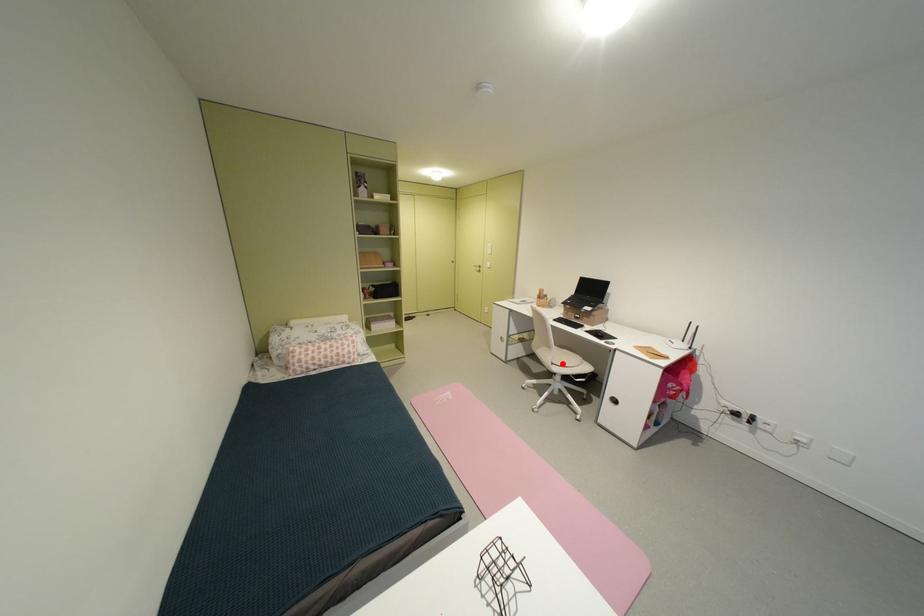
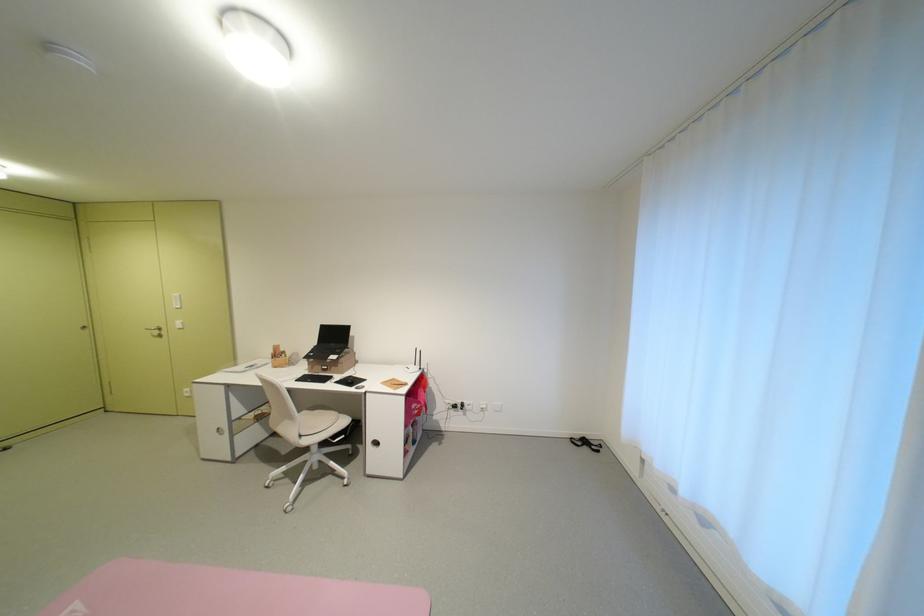
In the second image, find the point that corresponds to the highlighted location in the first image.

(311, 436)